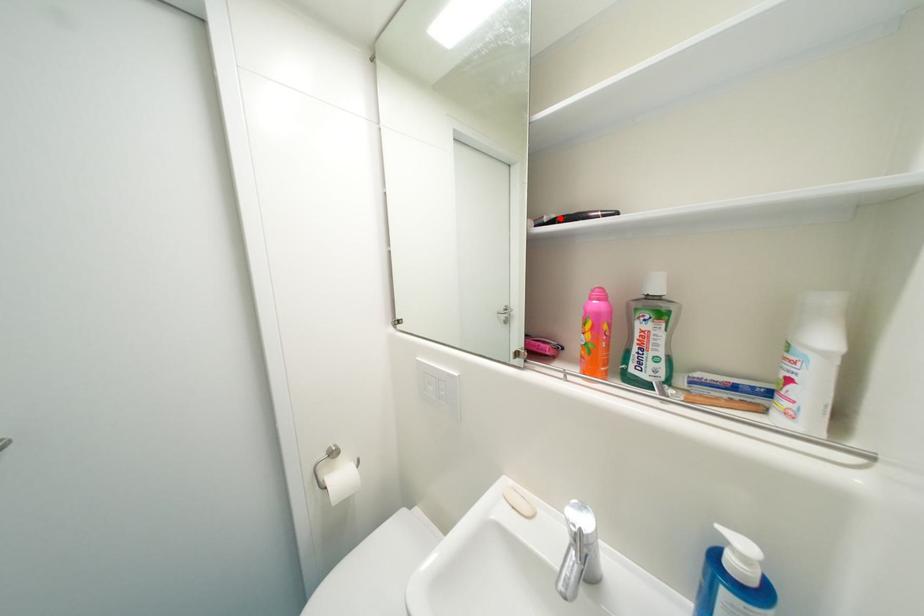
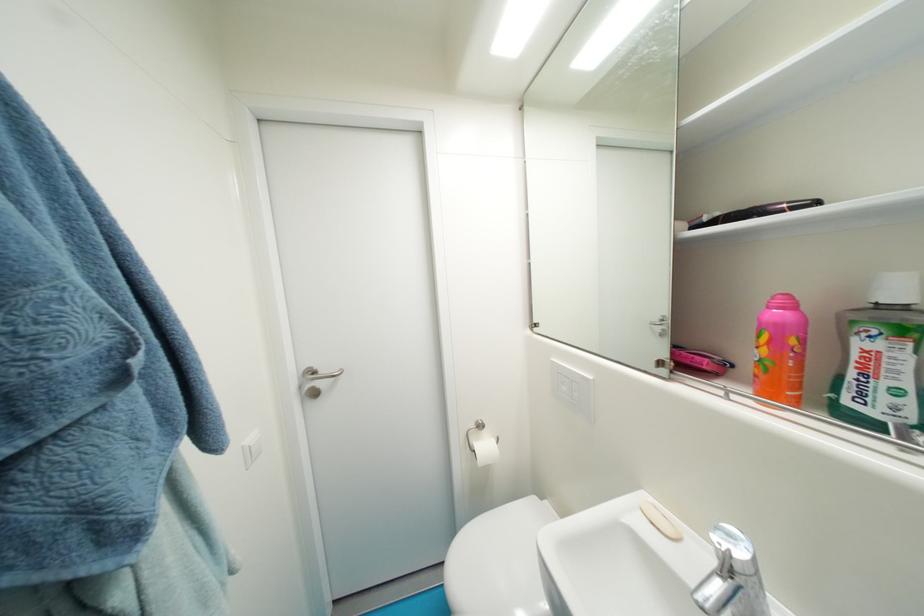
Question: I am providing you with two images of the same scene from different viewpoints. A red point is marked on the first image. At the location where the point appears in image 1, is it still visible in image 2?

Choices:
 (A) Yes
 (B) No

Answer: (A)